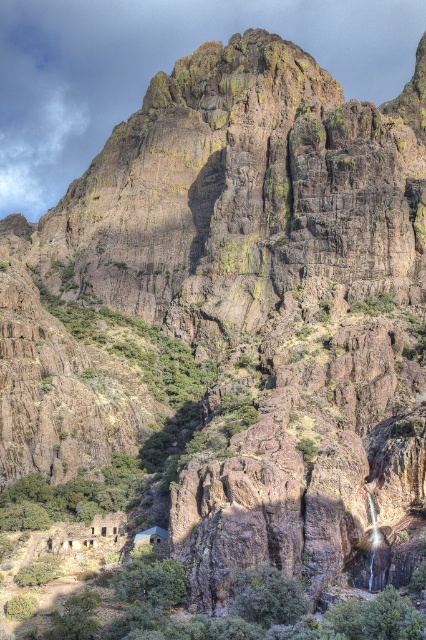
Consider the image. Between green leafy shrubs at lower center and rustic stone hut at center, which one appears on the left side from the viewer's perspective?

rustic stone hut at center

Which is in front, point (187, 624) or point (155, 550)?

Point (187, 624)

Is point (275, 634) more distant than point (164, 554)?

No, it is in front of (164, 554).

You are a GUI agent. You are given a task and a screenshot of the screen. Output one action in this format:
    pyautogui.click(x=<x>, y=<y>)
    Task: Click on the green leafy shrubs at lower center
    This screenshot has width=426, height=640.
    Given the screenshot: What is the action you would take?
    pyautogui.click(x=232, y=609)